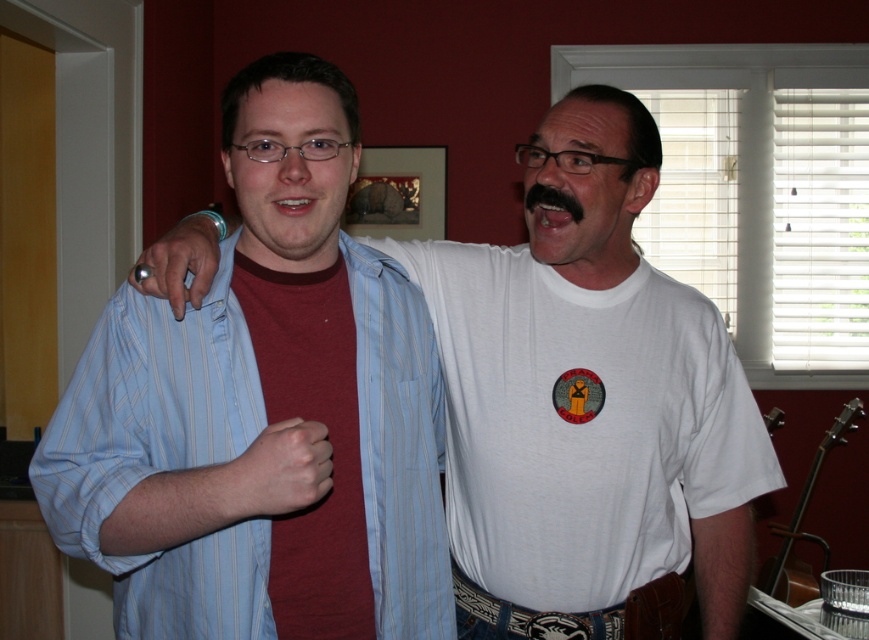
You are a photographer taking a portrait of the two people in the image. You notice the black fuzzy mustache at upper center and the white glossy teeth at center. Which facial feature is located above the other?

The black fuzzy mustache at upper center is positioned over the white glossy teeth at center.